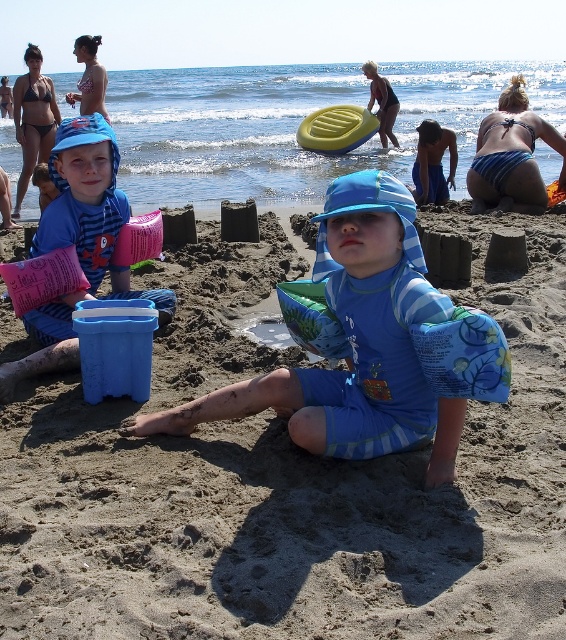
You are a photographer taking a picture of the beach scene. You want to ensure both the blue striped bikini at upper right and the dark blue swimsuit at upper center are clearly visible in your photo. Which of the two should you focus on first to make sure they are both in focus?

The blue striped bikini at upper right is in front of the dark blue swimsuit at upper center, so you should focus on the blue striped bikini at upper right first to ensure both are in focus.

You are a photographer trying to capture a group photo of the beach scene. You need to ensure that all subjects are visible. Given the blue striped bikini at upper right and the dark blue swimsuit at upper center, which one might be easier to fully include in the photo frame?

The blue striped bikini at upper right occupies less space than the dark blue swimsuit at upper center, so it might be easier to fully include the blue striped bikini at upper right in the photo frame since it takes up less area.